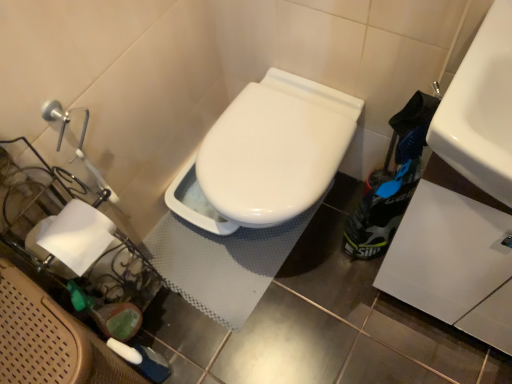
Question: Does white textured bath mat at center have a greater width compared to white glossy sink at upper right?

Choices:
 (A) no
 (B) yes

Answer: (B)

Question: From the image's perspective, is white textured bath mat at center under white glossy sink at upper right?

Choices:
 (A) no
 (B) yes

Answer: (B)

Question: Would you say white glossy sink at upper right is part of white textured bath mat at center's contents?

Choices:
 (A) yes
 (B) no

Answer: (B)

Question: From the image's perspective, is white textured bath mat at center above white glossy sink at upper right?

Choices:
 (A) no
 (B) yes

Answer: (A)

Question: Does white textured bath mat at center turn towards white glossy sink at upper right?

Choices:
 (A) yes
 (B) no

Answer: (B)

Question: Considering the positions of white textured bath mat at center and white paper at left in the image, is white textured bath mat at center wider or thinner than white paper at left?

Choices:
 (A) thin
 (B) wide

Answer: (B)

Question: From a real-world perspective, relative to white paper at left, is white textured bath mat at center vertically above or below?

Choices:
 (A) below
 (B) above

Answer: (A)

Question: In terms of size, does white textured bath mat at center appear bigger or smaller than white paper at left?

Choices:
 (A) big
 (B) small

Answer: (A)

Question: Based on their positions, is white textured bath mat at center located to the left or right of white paper at left?

Choices:
 (A) left
 (B) right

Answer: (B)

Question: Based on their sizes in the image, would you say white textured bath mat at center is bigger or smaller than white glossy sink at upper right?

Choices:
 (A) big
 (B) small

Answer: (A)

Question: Does point (321, 200) appear closer or farther from the camera than point (502, 125)?

Choices:
 (A) closer
 (B) farther

Answer: (B)

Question: Is white textured bath mat at center to the left or to the right of white glossy sink at upper right in the image?

Choices:
 (A) left
 (B) right

Answer: (A)

Question: Considering the positions of white textured bath mat at center and white glossy sink at upper right in the image, is white textured bath mat at center wider or thinner than white glossy sink at upper right?

Choices:
 (A) wide
 (B) thin

Answer: (A)

Question: Is white paper at left inside or outside of white glossy sink at upper right?

Choices:
 (A) inside
 (B) outside

Answer: (B)

Question: From the image's perspective, is white paper at left positioned above or below white glossy sink at upper right?

Choices:
 (A) below
 (B) above

Answer: (A)